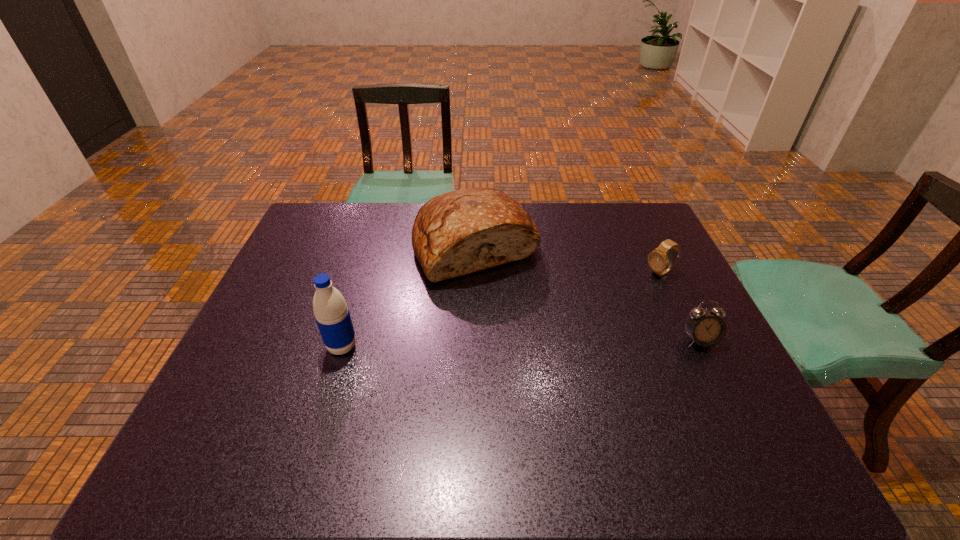
You are a GUI agent. You are given a task and a screenshot of the screen. Output one action in this format:
    pyautogui.click(x=<x>, y=<y>)
    Task: Click on the vacant space located on the face of the watch
    
    Given the screenshot: What is the action you would take?
    pyautogui.click(x=588, y=309)

Find the location of a particular element. vacant area situated on the face of the watch is located at coordinates (556, 325).

Find the location of a particular element. free space located 0.310m on the face of the watch is located at coordinates (568, 319).

Identify the location of object that is positioned at the far edge. This screenshot has width=960, height=540. (456, 233).

This screenshot has height=540, width=960. I want to click on alarm clock present at the right edge, so click(705, 328).

At what (x,y) coordinates should I click in order to perform the action: click on watch positioned at the right edge. Please return your answer as a coordinate pair (x, y). This screenshot has width=960, height=540. Looking at the image, I should click on (660, 263).

Image resolution: width=960 pixels, height=540 pixels. In order to click on free location at the far edge in this screenshot , I will do `click(584, 208)`.

What are the coordinates of `vacant space at the near edge of the desktop` in the screenshot? It's located at (564, 415).

The height and width of the screenshot is (540, 960). In the image, there is a desktop. Find the location of `vacant space at the left edge`. vacant space at the left edge is located at coordinates (261, 328).

The height and width of the screenshot is (540, 960). Find the location of `free region at the right edge`. free region at the right edge is located at coordinates (730, 379).